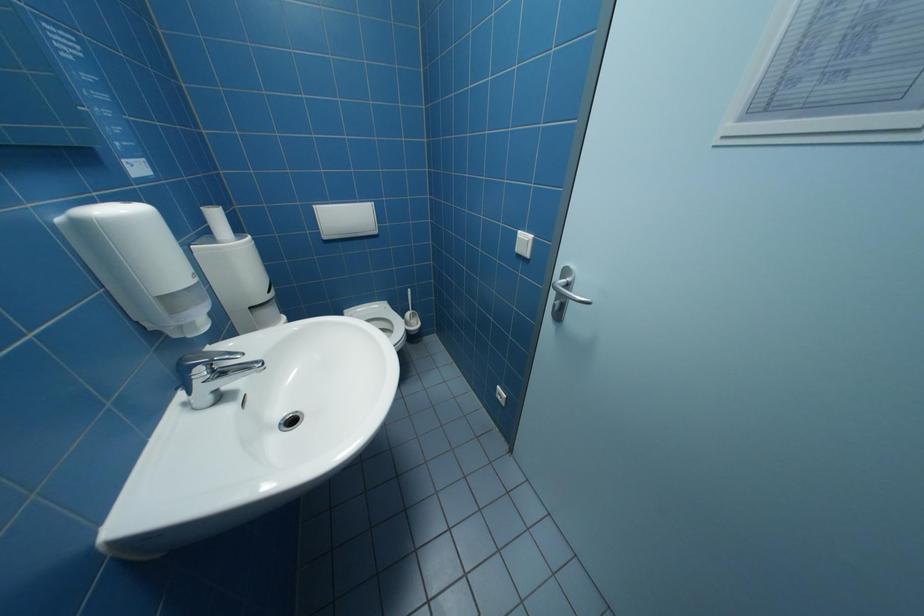
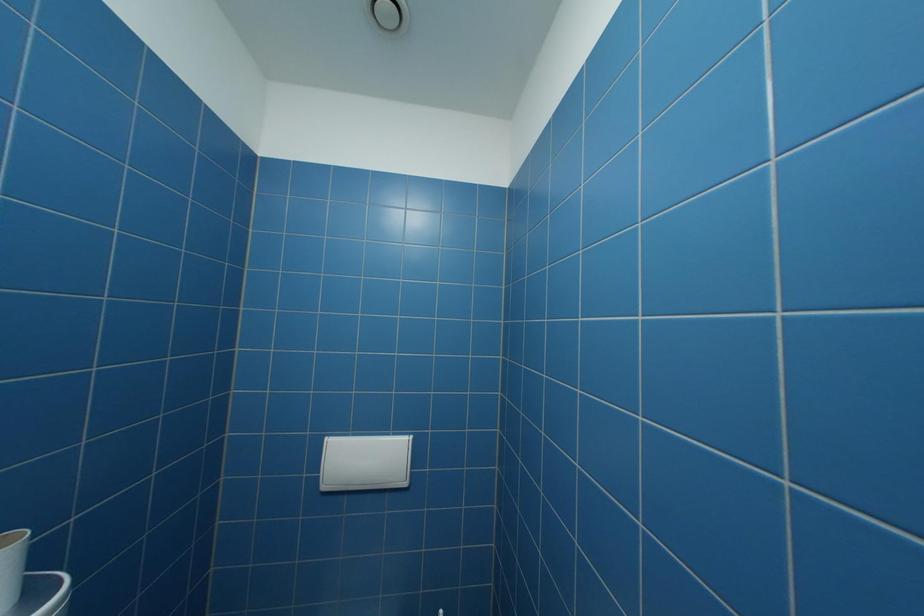
The first image is from the beginning of the video and the second image is from the end. How did the camera likely rotate when shooting the video?

The rotation direction of the camera is left-up.